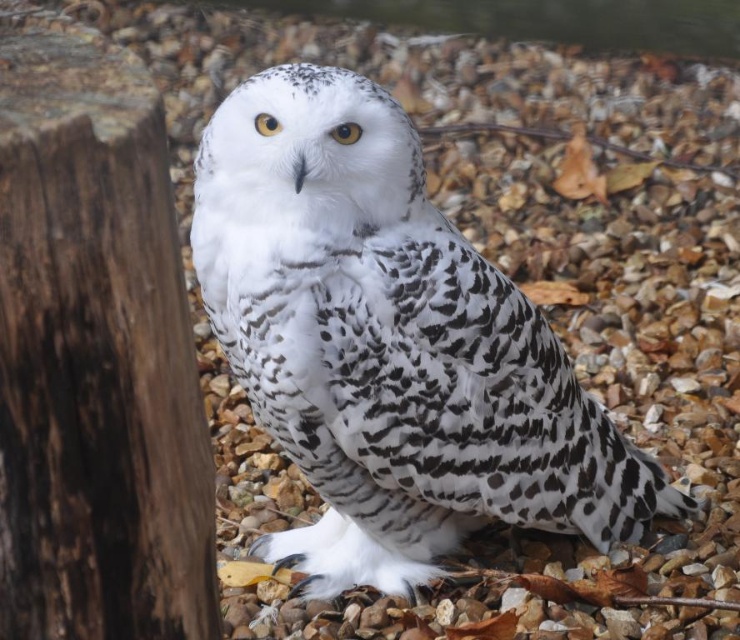
Who is lower down, white speckled owl at center or dark brown rough wood at left?

Positioned lower is white speckled owl at center.

How much distance is there between white speckled owl at center and dark brown rough wood at left?

white speckled owl at center and dark brown rough wood at left are 32.64 inches apart.

Image resolution: width=740 pixels, height=640 pixels. In order to click on white speckled owl at center in this screenshot , I will do `click(388, 346)`.